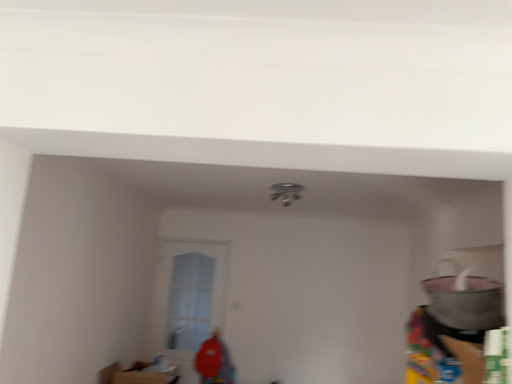
Question: In terms of height, does clear glass door at center look taller or shorter compared to matte gray pot at right?

Choices:
 (A) short
 (B) tall

Answer: (B)

Question: From a real-world perspective, relative to matte gray pot at right, is clear glass door at center vertically above or below?

Choices:
 (A) above
 (B) below

Answer: (B)

Question: Based on their sizes in the image, would you say clear glass door at center is bigger or smaller than matte gray pot at right?

Choices:
 (A) big
 (B) small

Answer: (B)

Question: Does point (478, 286) appear closer or farther from the camera than point (207, 284)?

Choices:
 (A) closer
 (B) farther

Answer: (A)

Question: From the image's perspective, is matte gray pot at right positioned above or below clear glass door at center?

Choices:
 (A) above
 (B) below

Answer: (A)

Question: Visually, is matte gray pot at right positioned to the left or to the right of clear glass door at center?

Choices:
 (A) right
 (B) left

Answer: (A)

Question: Looking at their shapes, would you say matte gray pot at right is wider or thinner than clear glass door at center?

Choices:
 (A) wide
 (B) thin

Answer: (A)